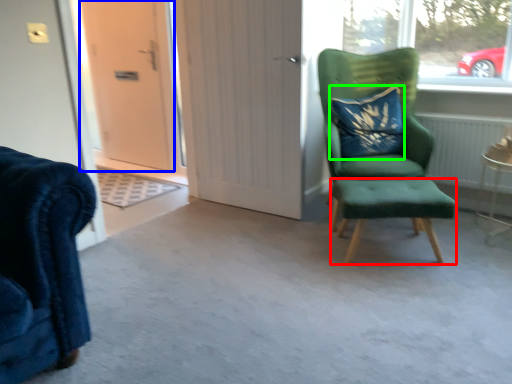
Question: Based on their relative distances, which object is nearer to stool (highlighted by a red box)? Choose from door (highlighted by a blue box) and pillow (highlighted by a green box).

Choices:
 (A) door
 (B) pillow

Answer: (B)